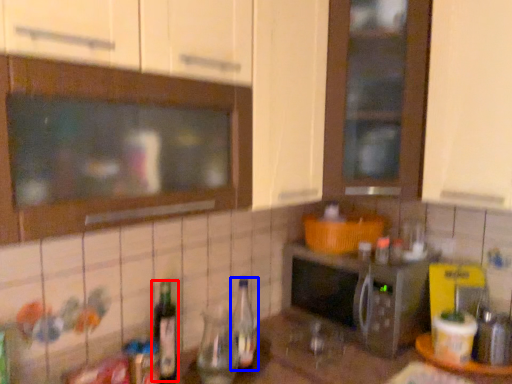
Question: Which of the following is the farthest to the observer, bottle (highlighted by a red box) or bottle (highlighted by a blue box)?

Choices:
 (A) bottle
 (B) bottle

Answer: (B)